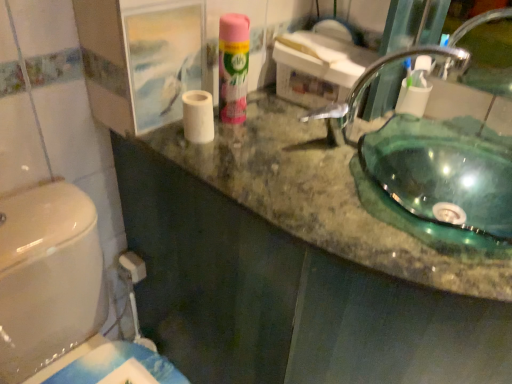
Where is `vacant space to the right of pink matte air freshener at upper center`? The image size is (512, 384). vacant space to the right of pink matte air freshener at upper center is located at coordinates (291, 128).